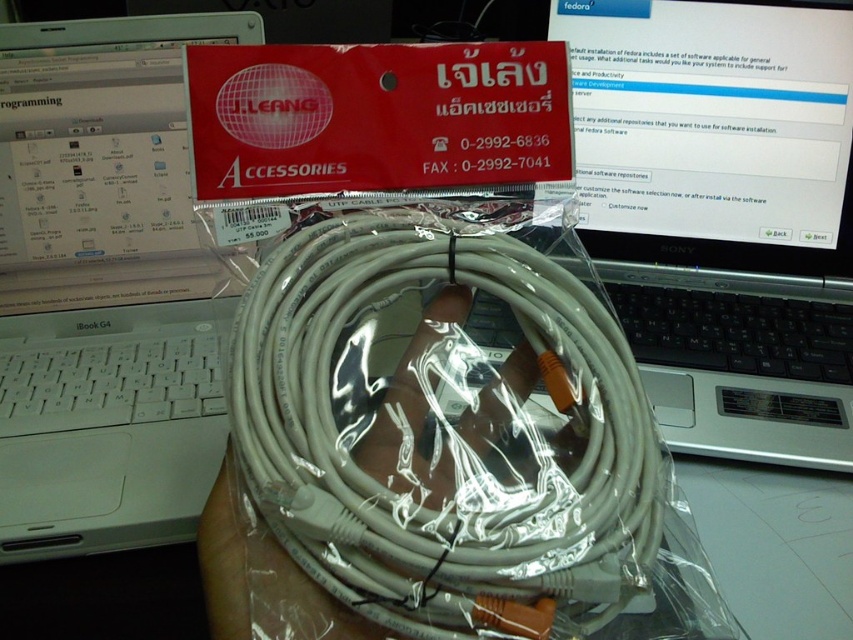
You are setting up a network connection in an office. You have a white plastic cable at center and a white plastic laptop at center in front of you. Which object is positioned to the right side?

The white plastic cable at center is to the right of the white plastic laptop at center.

You are setting up a new network connection and need to connect the white plastic cable at center to the white plastic laptop at center. Based on the scene, can you determine if the cable is positioned in a way that allows easy access to plug it into the laptop?

The white plastic cable at center is in front of the white plastic laptop at center, so it is positioned in a way that allows easy access to plug it into the laptop.

You are a delivery person who needs to place both the silver metallic laptop at upper right and the white plastic laptop at center into a box. The box can only hold items within 20 inches between them. Can you safely place both laptops in the box?

The silver metallic laptop at upper right is 19.62 inches from the white plastic laptop at center, which is under the 20 inches limit. Therefore, you can safely place both laptops in the box.